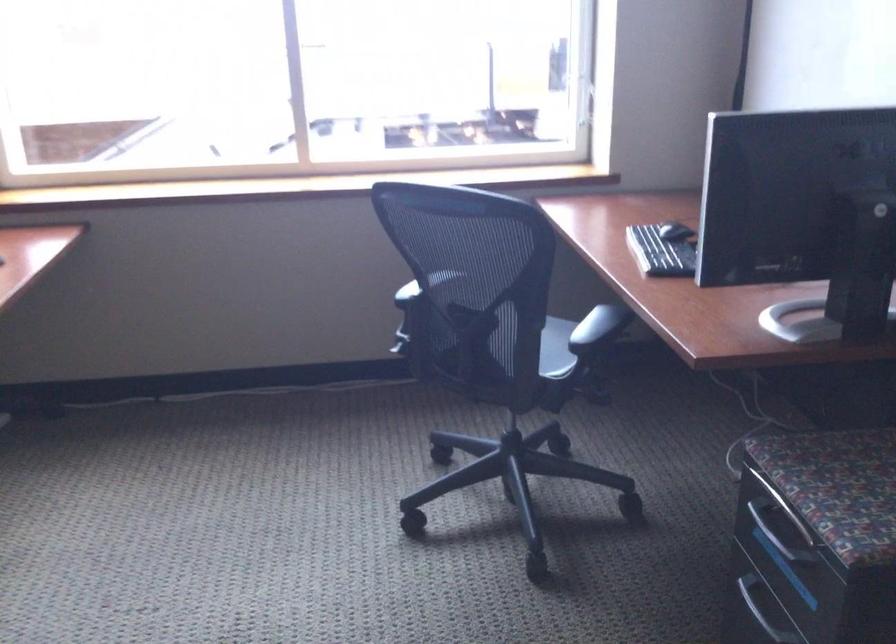
This screenshot has height=644, width=896. Describe the element at coordinates (541, 345) in the screenshot. I see `a chair sitting surface` at that location.